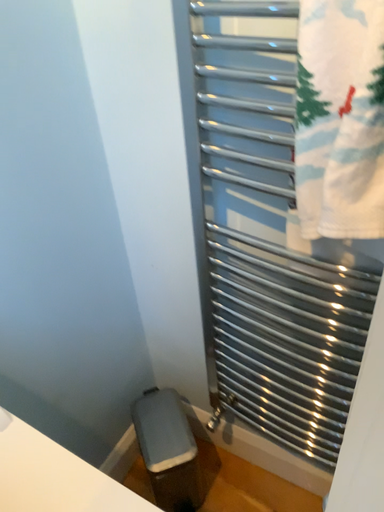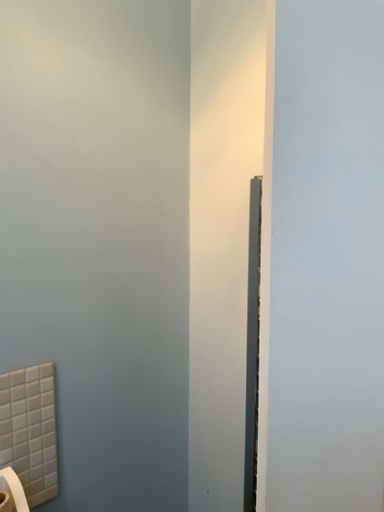
Question: Which way did the camera rotate in the video?

Choices:
 (A) rotated upward
 (B) rotated downward

Answer: (A)